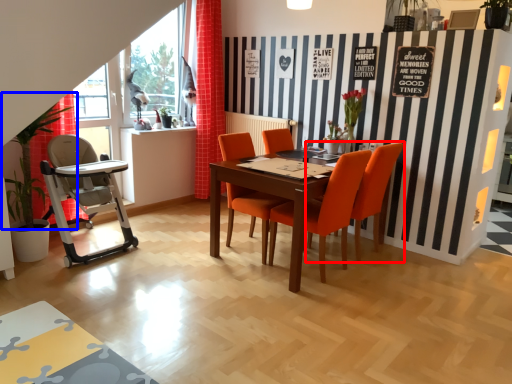
Question: Among these objects, which one is farthest to the camera, chair (highlighted by a red box) or plant (highlighted by a blue box)?

Choices:
 (A) chair
 (B) plant

Answer: (A)